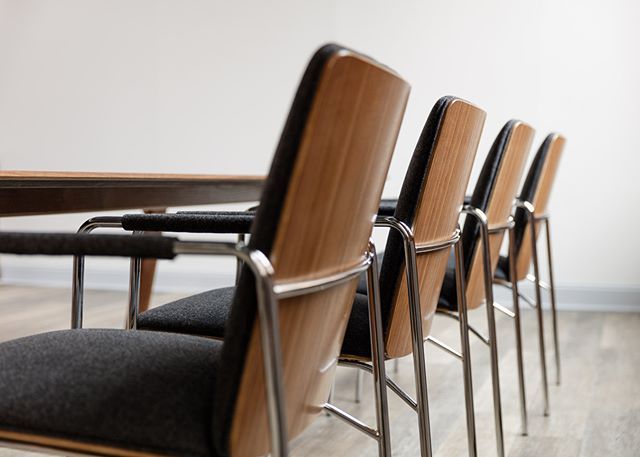
Find the location of a particular element. Image resolution: width=640 pixels, height=457 pixels. rear chair legs is located at coordinates (278, 415), (376, 401), (419, 398), (470, 392), (496, 384), (521, 377), (541, 361), (560, 355).